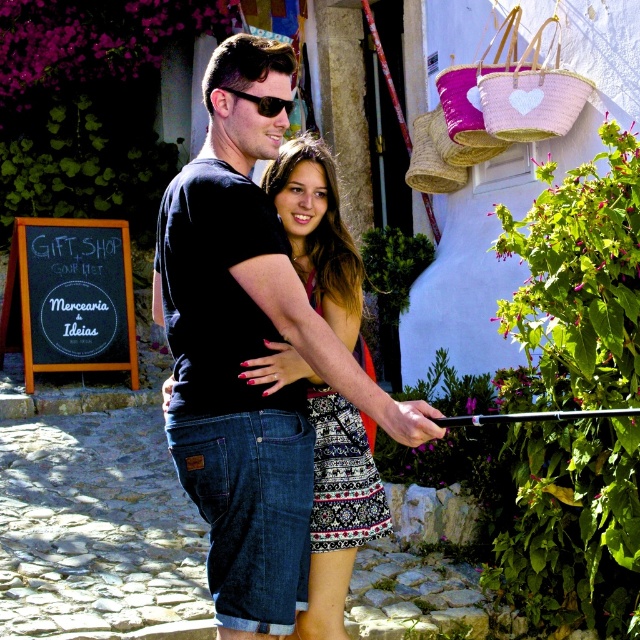
You are a photographer standing 5 feet away from the black denim shorts at center and the black printed fabric dress at center. You want to take a photo of both of them in the same frame. Can you position yourself so that both are in focus without moving them?

The black denim shorts at center is 3.33 feet away from the black printed fabric dress at center. Since the distance between them is less than the depth of field of a typical camera lens at 5 feet, you can position yourself so that both are in focus without moving them.

You are standing in front of the two people in the image. Which of the two items, the black denim shorts at center or the patterned fabric skirt at center, is closer to you?

The black denim shorts at center is closer to the viewer than the patterned fabric skirt at center.